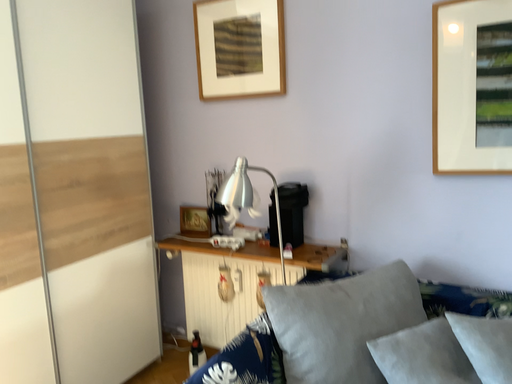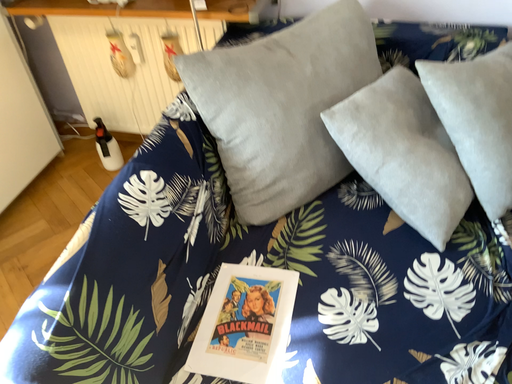
Question: How did the camera likely rotate when shooting the video?

Choices:
 (A) rotated downward
 (B) rotated upward

Answer: (A)